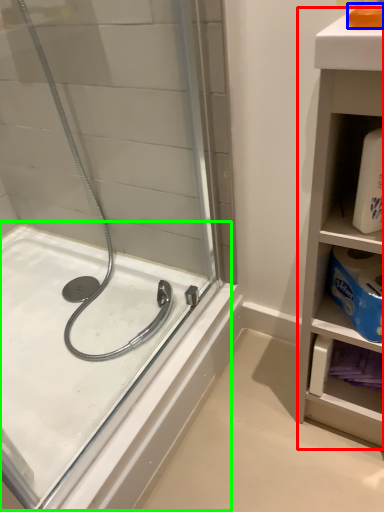
Question: Estimate the real-world distances between objects in this image. Which object is closer to bathroom cabinet (highlighted by a red box), soap (highlighted by a blue box) or bath (highlighted by a green box)?

Choices:
 (A) soap
 (B) bath

Answer: (A)